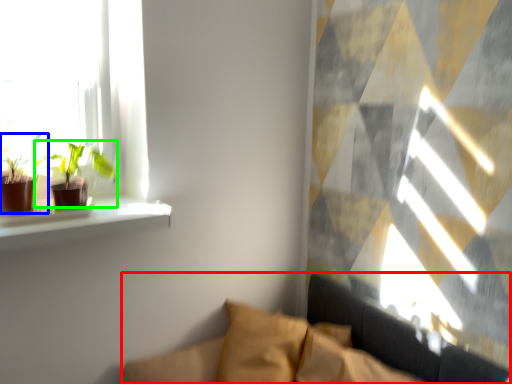
Question: Considering the real-world distances, which object is farthest from couch (highlighted by a red box)? houseplant (highlighted by a blue box) or houseplant (highlighted by a green box)?

Choices:
 (A) houseplant
 (B) houseplant

Answer: (A)